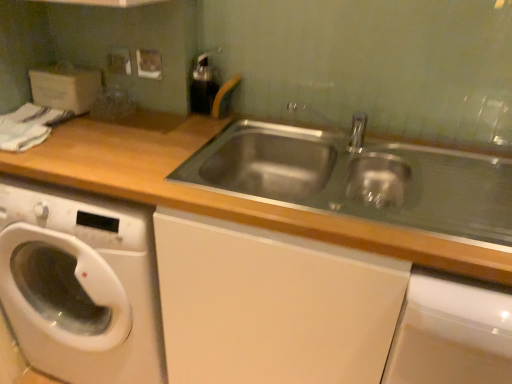
In order to face metallic silver electric outlet at upper left, should I rotate leftwards or rightwards?

It's best to rotate left around 17.705 degrees.

You are a GUI agent. You are given a task and a screenshot of the screen. Output one action in this format:
    pyautogui.click(x=<x>, y=<y>)
    Task: Click on the white glossy washing machine at lower left
    Image resolution: width=512 pixels, height=384 pixels.
    Given the screenshot: What is the action you would take?
    pyautogui.click(x=81, y=284)

Describe the element at coordinates (219, 193) in the screenshot. This screenshot has width=512, height=384. I see `wooden at left` at that location.

You are a GUI agent. You are given a task and a screenshot of the screen. Output one action in this format:
    pyautogui.click(x=<x>, y=<y>)
    Task: Click on the metallic silver electric outlet at upper left
    The image size is (512, 384).
    Given the screenshot: What is the action you would take?
    pyautogui.click(x=119, y=61)

Is wooden at left not near white glossy washing machine at lower left?

Actually, wooden at left and white glossy washing machine at lower left are a little close together.

How far apart are wooden at left and white glossy washing machine at lower left?

wooden at left is 14.80 inches from white glossy washing machine at lower left.

In terms of height, does wooden at left look taller or shorter compared to white glossy washing machine at lower left?

wooden at left is taller than white glossy washing machine at lower left.

Is white glossy washing machine at lower left at the back of metallic silver electric outlet at upper left?

No.

Could you measure the distance between metallic silver electric outlet at upper left and white glossy washing machine at lower left?

A distance of 30.49 inches exists between metallic silver electric outlet at upper left and white glossy washing machine at lower left.

Is the depth of metallic silver electric outlet at upper left less than that of white glossy washing machine at lower left?

No, metallic silver electric outlet at upper left is further to the viewer.

From their relative heights in the image, would you say metallic silver electric outlet at upper left is taller or shorter than white glossy washing machine at lower left?

Considering their sizes, metallic silver electric outlet at upper left has less height than white glossy washing machine at lower left.

You are a GUI agent. You are given a task and a screenshot of the screen. Output one action in this format:
    pyautogui.click(x=<x>, y=<y>)
    Task: Click on the countertop lying in front of the metallic silver electric outlet at upper left
    The height and width of the screenshot is (384, 512).
    Given the screenshot: What is the action you would take?
    pyautogui.click(x=219, y=193)

Does wooden at left come in front of metallic silver electric outlet at upper left?

Yes, the depth of wooden at left is less than that of metallic silver electric outlet at upper left.

In the scene shown: Is wooden at left positioned with its back to metallic silver electric outlet at upper left?

No.

Which is more to the right, wooden at left or metallic silver electric outlet at upper left?

From the viewer's perspective, wooden at left appears more on the right side.

Which of these two, white glossy washing machine at lower left or wooden at left, is thinner?

Thinner between the two is white glossy washing machine at lower left.

Can you confirm if white glossy washing machine at lower left is positioned to the right of wooden at left?

No, white glossy washing machine at lower left is not to the right of wooden at left.

Is white glossy washing machine at lower left directly adjacent to wooden at left?

No, white glossy washing machine at lower left is not in contact with wooden at left.

Between point (61, 230) and point (145, 186), which one is positioned behind?

The point (61, 230) is more distant.

Does white glossy washing machine at lower left have a greater height compared to metallic silver electric outlet at upper left?

Correct, white glossy washing machine at lower left is much taller as metallic silver electric outlet at upper left.

Would you say white glossy washing machine at lower left is a long distance from metallic silver electric outlet at upper left?

white glossy washing machine at lower left is actually quite close to metallic silver electric outlet at upper left.

From a real-world perspective, relative to metallic silver electric outlet at upper left, is white glossy washing machine at lower left vertically above or below?

white glossy washing machine at lower left is below metallic silver electric outlet at upper left.

Which is more to the left, metallic silver electric outlet at upper left or wooden at left?

From the viewer's perspective, metallic silver electric outlet at upper left appears more on the left side.

Based on their sizes in the image, would you say metallic silver electric outlet at upper left is bigger or smaller than wooden at left?

Considering their sizes, metallic silver electric outlet at upper left takes up less space than wooden at left.

Who is taller, metallic silver electric outlet at upper left or wooden at left?

wooden at left is taller.

Is point (118, 61) closer to viewer compared to point (416, 258)?

No, it is not.

The height and width of the screenshot is (384, 512). Find the location of `washing machine lying behind the wooden at left`. washing machine lying behind the wooden at left is located at coordinates (81, 284).

I want to click on washing machine in front of the metallic silver electric outlet at upper left, so click(x=81, y=284).

Estimate the real-world distances between objects in this image. Which object is closer to metallic silver electric outlet at upper left, wooden at left or white glossy washing machine at lower left?

The object closer to metallic silver electric outlet at upper left is wooden at left.

Considering their positions, is wooden at left positioned closer to white glossy washing machine at lower left than metallic silver electric outlet at upper left?

wooden at left is closer to white glossy washing machine at lower left.

Looking at the image, which one is located further to white glossy washing machine at lower left, metallic silver electric outlet at upper left or wooden at left?

Among the two, metallic silver electric outlet at upper left is located further to white glossy washing machine at lower left.

Estimate the real-world distances between objects in this image. Which object is closer to wooden at left, white glossy washing machine at lower left or metallic silver electric outlet at upper left?

white glossy washing machine at lower left is positioned closer to the anchor wooden at left.

Considering their positions, is metallic silver electric outlet at upper left positioned closer to wooden at left than white glossy washing machine at lower left?

white glossy washing machine at lower left is positioned closer to the anchor wooden at left.

Estimate the real-world distances between objects in this image. Which object is further from metallic silver electric outlet at upper left, white glossy washing machine at lower left or wooden at left?

white glossy washing machine at lower left lies further to metallic silver electric outlet at upper left than the other object.

I want to click on washing machine between metallic silver electric outlet at upper left and wooden at left vertically, so click(x=81, y=284).